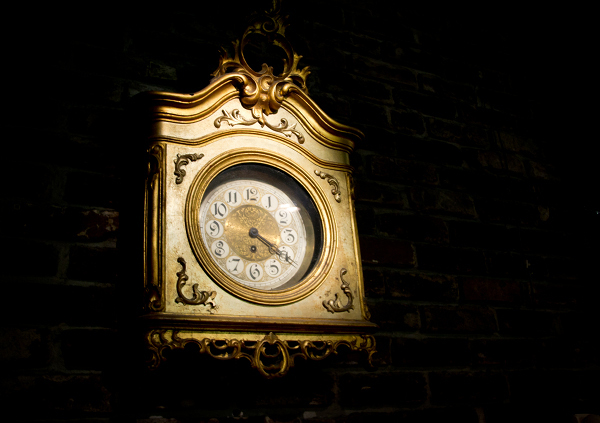
Where is `space left of wall clock`? The image size is (600, 423). space left of wall clock is located at coordinates (138, 246).